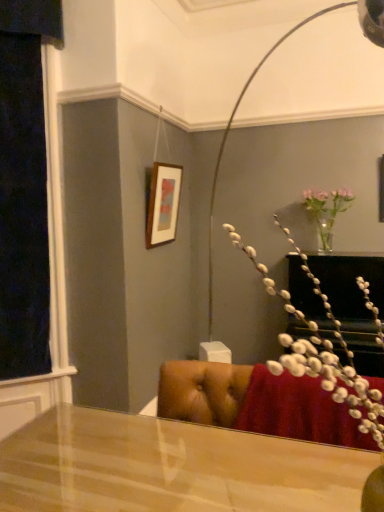
This screenshot has height=512, width=384. What are the coordinates of `wooden frame at upper center` in the screenshot? It's located at (163, 204).

What do you see at coordinates (163, 204) in the screenshot?
I see `wooden frame at upper center` at bounding box center [163, 204].

I want to click on wooden frame at upper center, so click(x=163, y=204).